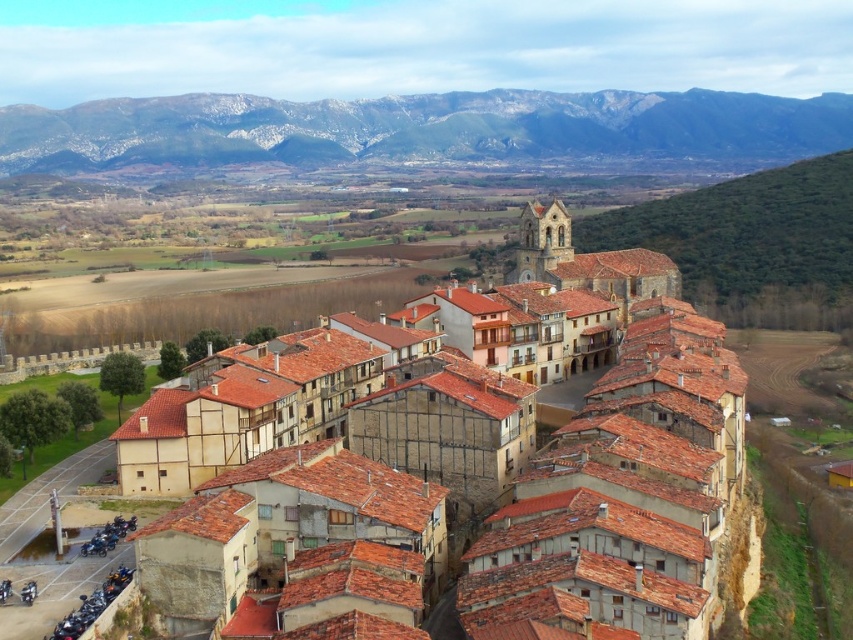
Question: Can you confirm if brown clay roof tiles at center is positioned above gray rocky mountain at upper center?

Choices:
 (A) yes
 (B) no

Answer: (B)

Question: Can you confirm if brown clay roof tiles at center is bigger than gray rocky mountain at upper center?

Choices:
 (A) yes
 (B) no

Answer: (B)

Question: Can you confirm if brown clay roof tiles at center is positioned to the right of gray rocky mountain at upper center?

Choices:
 (A) yes
 (B) no

Answer: (A)

Question: Which point appears farthest from the camera in this image?

Choices:
 (A) (318, 125)
 (B) (230, 378)

Answer: (A)